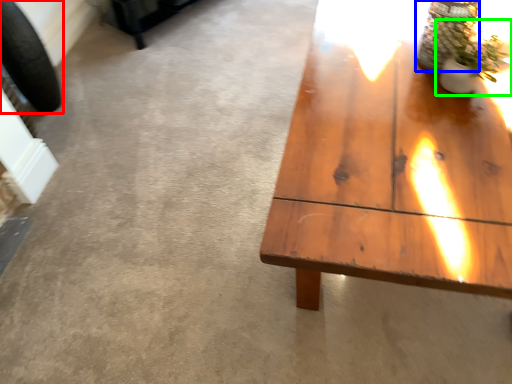
Question: Which is nearer to the car tire (highlighted by a red box)? glass vase (highlighted by a blue box) or houseplant (highlighted by a green box).

Choices:
 (A) glass vase
 (B) houseplant

Answer: (A)